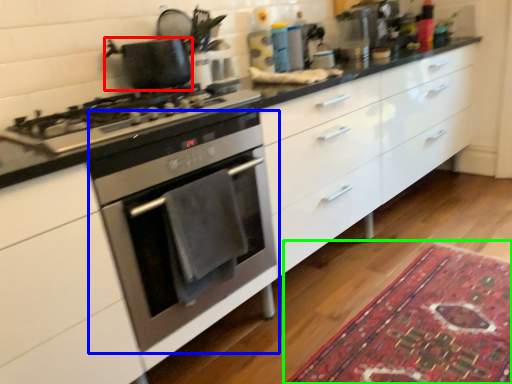
Question: Which object is the farthest from kitchen appliance (highlighted by a red box)? Choose among these: oven (highlighted by a blue box) or mat (highlighted by a green box).

Choices:
 (A) oven
 (B) mat

Answer: (B)